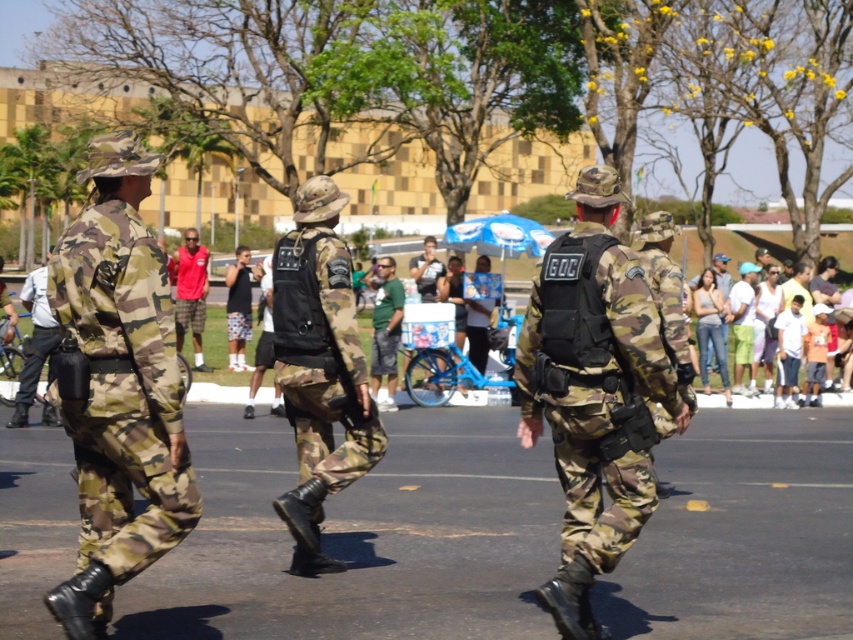
You are a photographer trying to capture the camo fabric uniform at center in the image. Based on the scene description, where should you focus your camera to ensure the uniform is in the frame?

The camo fabric uniform at center is located at point (595, 394), so you should focus your camera at those coordinates to ensure the uniform is centered in the frame.

You are a photographer positioned at the front of the formation of soldiers. You want to take a photo that includes both the point at coordinates point [84,618] and point [285,308]. Which point should you focus on first to ensure both are in sharp focus?

You should focus on point [84,618] first because it is closer to the viewer than point [285,308]. By focusing on the closer point, the farther point will also be within the depth of field, ensuring both are in sharp focus.